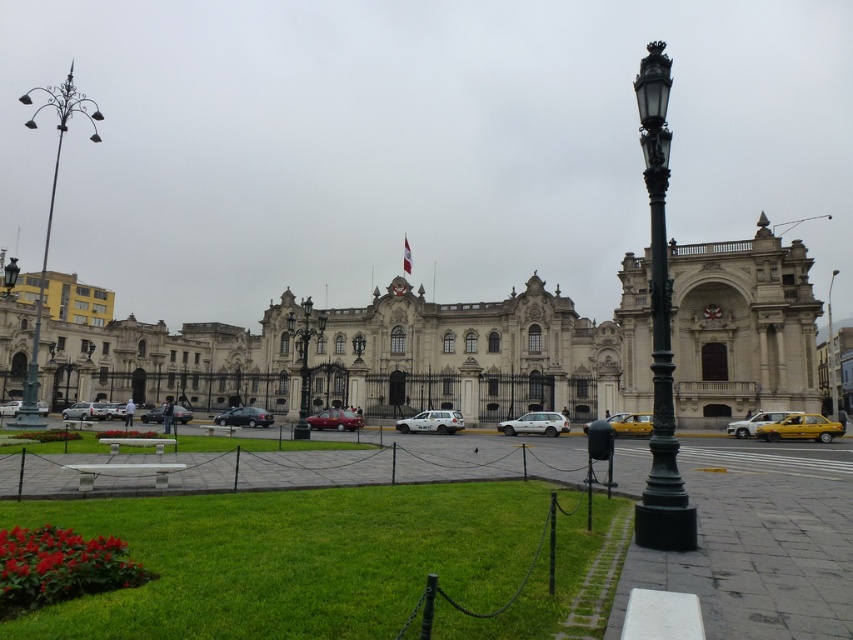
Question: Which point is farther from the camera taking this photo?

Choices:
 (A) (13, 400)
 (B) (454, 422)

Answer: (A)

Question: Considering the relative positions of green metal/bronze streetlamp at right and polished metal streetlamp at center in the image provided, where is green metal/bronze streetlamp at right located with respect to polished metal streetlamp at center?

Choices:
 (A) below
 (B) above

Answer: (B)

Question: Which object is closer to the camera taking this photo?

Choices:
 (A) matte silver sedan at center-left
 (B) white matte van at center
 (C) matte silver sedan at center
 (D) polished metal streetlamp at center

Answer: (D)

Question: Is green painted metal pole at left smaller than matte silver sedan at center-left?

Choices:
 (A) yes
 (B) no

Answer: (B)

Question: Is green painted metal pole at left above metallic silver car at lower left?

Choices:
 (A) no
 (B) yes

Answer: (B)

Question: Which of these objects is positioned farthest from the yellow matte taxi at right?

Choices:
 (A) white stone building at center
 (B) yellow matte taxi at center-right
 (C) metallic silver car at lower left

Answer: (C)